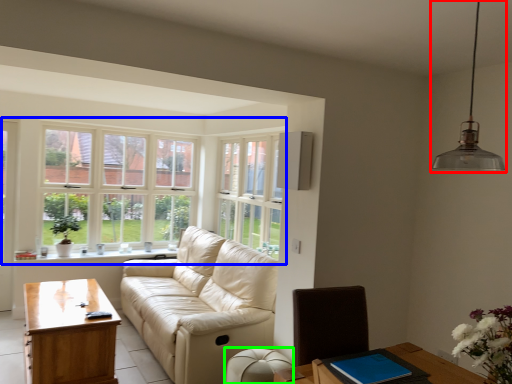
Question: Which object is the farthest from light fixture (highlighted by a red box)? Choose among these: window (highlighted by a blue box) or armchair (highlighted by a green box).

Choices:
 (A) window
 (B) armchair

Answer: (A)